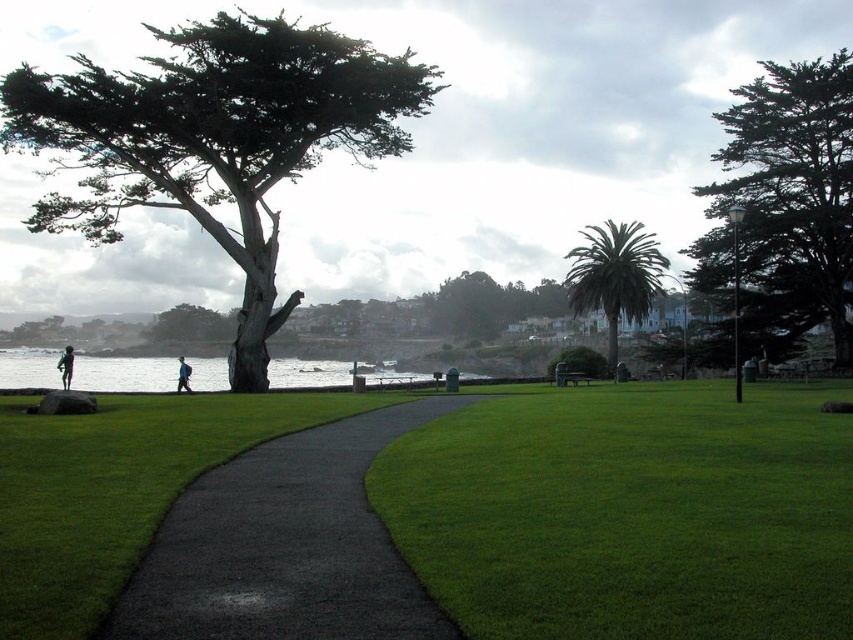
Is green grass at center closer to the viewer compared to green textured tree at left?

Yes, it is.

Is point (639, 582) less distant than point (231, 140)?

Yes, point (639, 582) is closer to viewer.

Is point (759, 404) more distant than point (90, 236)?

No, (759, 404) is in front of (90, 236).

The image size is (853, 640). What are the coordinates of `green grass at center` in the screenshot? It's located at (630, 513).

Which of these two, green textured tree at right or green leafy palm tree at center, stands taller?

green textured tree at right is taller.

Is green textured tree at right further to the viewer compared to green leafy palm tree at center?

No, green textured tree at right is in front of green leafy palm tree at center.

Locate an element on the screen. The image size is (853, 640). green textured tree at right is located at coordinates (792, 196).

Is green grass at center further to the viewer compared to silhouette figure at left?

No, green grass at center is in front of silhouette figure at left.

Does green grass at center have a larger size compared to silhouette figure at left?

No, green grass at center is not bigger than silhouette figure at left.

At what (x,y) coordinates should I click in order to perform the action: click on green grass at center. Please return your answer as a coordinate pair (x, y). Image resolution: width=853 pixels, height=640 pixels. Looking at the image, I should click on (630, 513).